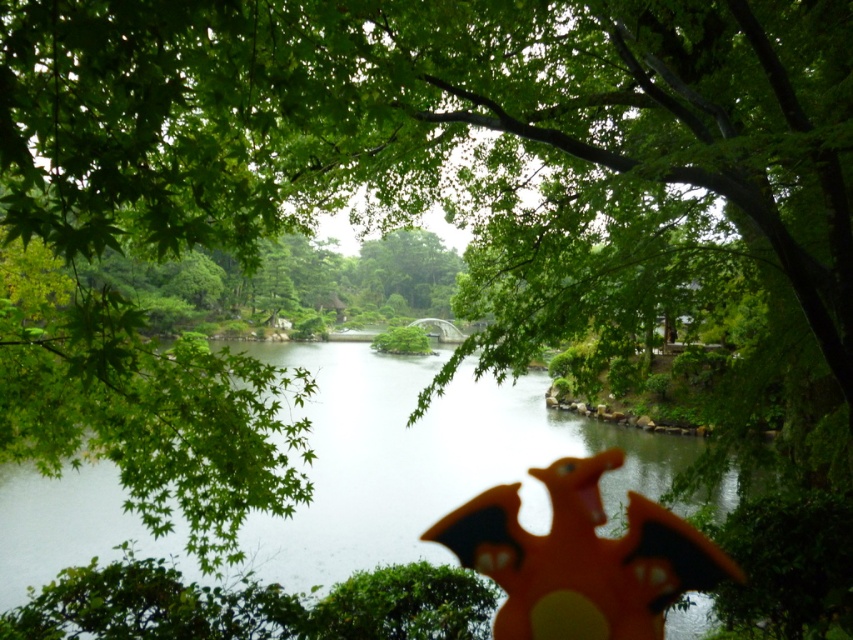
Can you confirm if transparent water at center is bigger than orange matte dragon at center?

Correct, transparent water at center is larger in size than orange matte dragon at center.

Is transparent water at center positioned before orange matte dragon at center?

Yes, transparent water at center is in front of orange matte dragon at center.

Find the location of `transparent water at center`. transparent water at center is located at coordinates (424, 458).

Locate an element on the screen. transparent water at center is located at coordinates (424, 458).